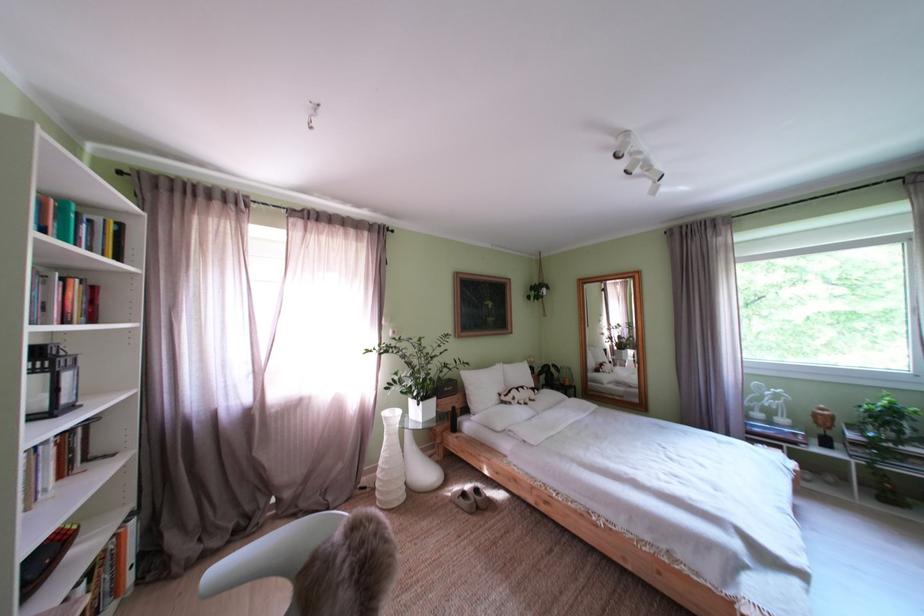
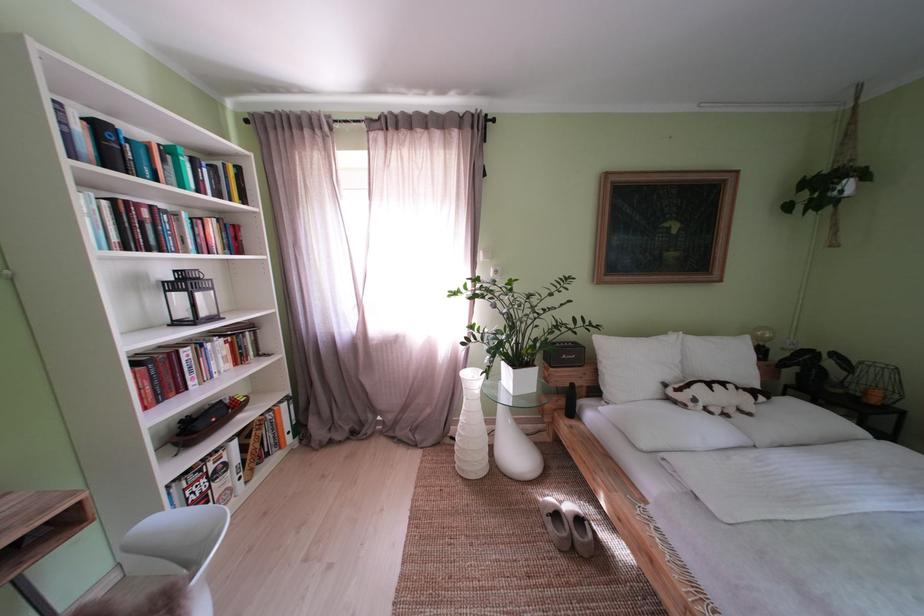
Where in the second image is the point corresponding to point 395,460 from the first image?

(472, 424)